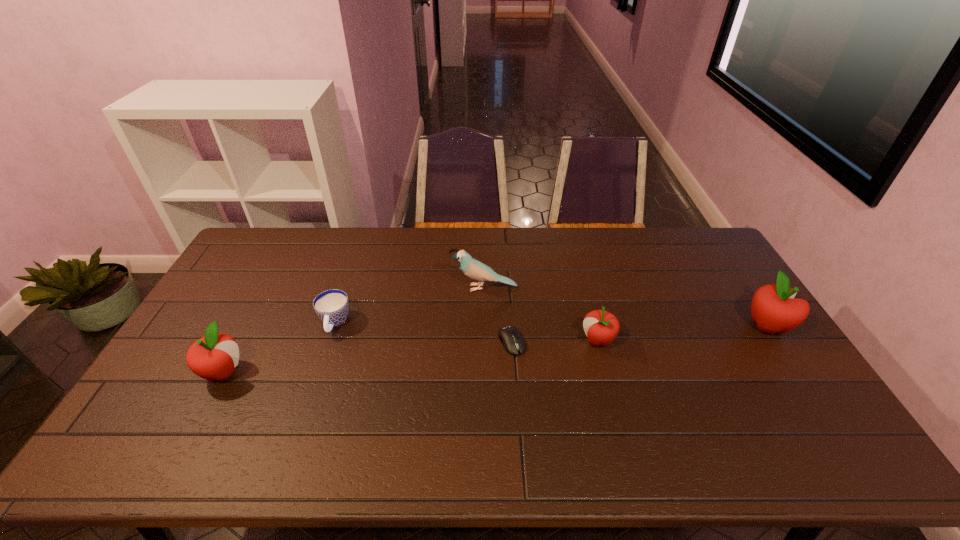
The height and width of the screenshot is (540, 960). I want to click on vacant region that satisfies the following two spatial constraints: 1. at the face of the bird; 2. on the back side of the computer equipment, so click(485, 342).

Image resolution: width=960 pixels, height=540 pixels. What are the coordinates of `free spot that satisfies the following two spatial constraints: 1. at the face of the farthest object; 2. on the left side of the rightmost object` in the screenshot? It's located at (485, 326).

Locate an element on the screen. This screenshot has width=960, height=540. vacant position in the image that satisfies the following two spatial constraints: 1. on the side of the fifth object from right to left with the handle; 2. on the right side of the rightmost apple is located at coordinates (333, 326).

You are a GUI agent. You are given a task and a screenshot of the screen. Output one action in this format:
    pyautogui.click(x=<x>, y=<y>)
    Task: Click on the free spot that satisfies the following two spatial constraints: 1. on the side of the shortest object with the handle; 2. on the left side of the fifth object from right to left
    Image resolution: width=960 pixels, height=540 pixels.
    Given the screenshot: What is the action you would take?
    pyautogui.click(x=328, y=342)

In order to click on vacant point that satisfies the following two spatial constraints: 1. on the side of the fifth tallest object with the handle; 2. on the left side of the rightmost object in this screenshot , I will do `click(333, 326)`.

The height and width of the screenshot is (540, 960). Find the location of `blank space that satisfies the following two spatial constraints: 1. at the face of the bird; 2. on the back side of the rightmost object`. blank space that satisfies the following two spatial constraints: 1. at the face of the bird; 2. on the back side of the rightmost object is located at coordinates (485, 326).

Locate an element on the screen. This screenshot has width=960, height=540. blank space that satisfies the following two spatial constraints: 1. at the face of the farthest object; 2. on the back side of the rightmost apple is located at coordinates 485,326.

At what (x,y) coordinates should I click in order to perform the action: click on vacant space that satisfies the following two spatial constraints: 1. at the face of the farthest object; 2. on the side of the fifth tallest object with the handle. Please return your answer as a coordinate pair (x, y). Looking at the image, I should click on (485, 323).